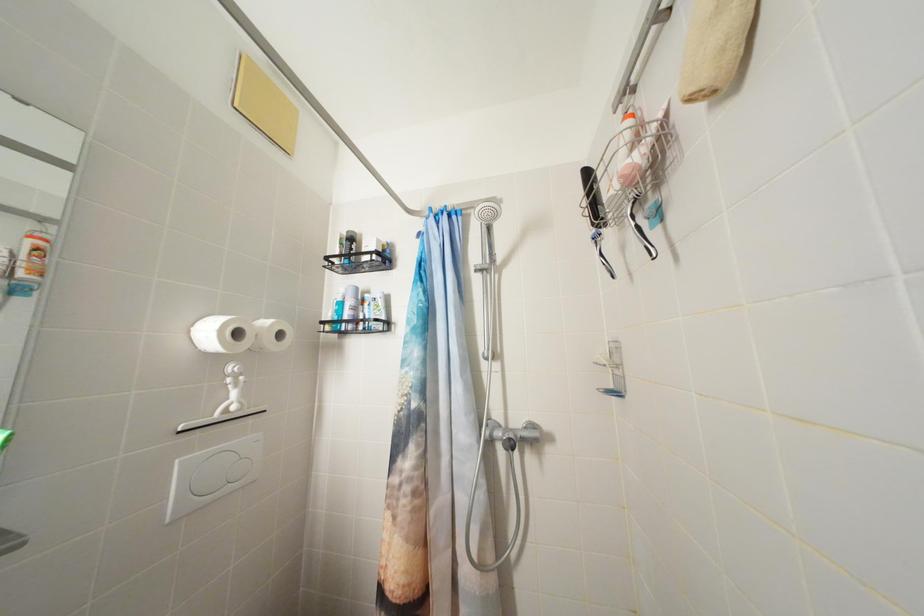
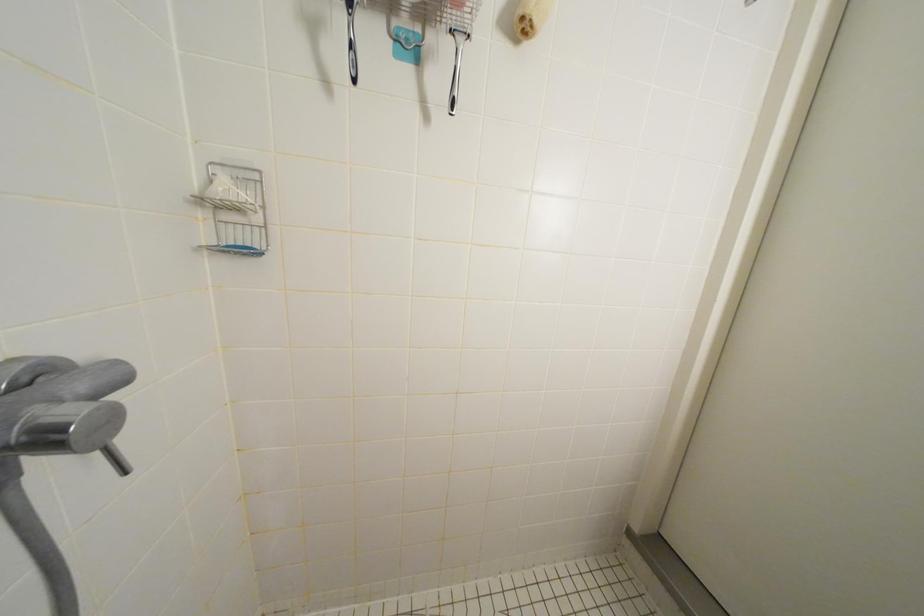
Question: Based on the continuous images, in which direction is the camera rotating? Reply with the corresponding letter.

Choices:
 (A) Left
 (B) Right
 (C) Up
 (D) Down

Answer: (B)